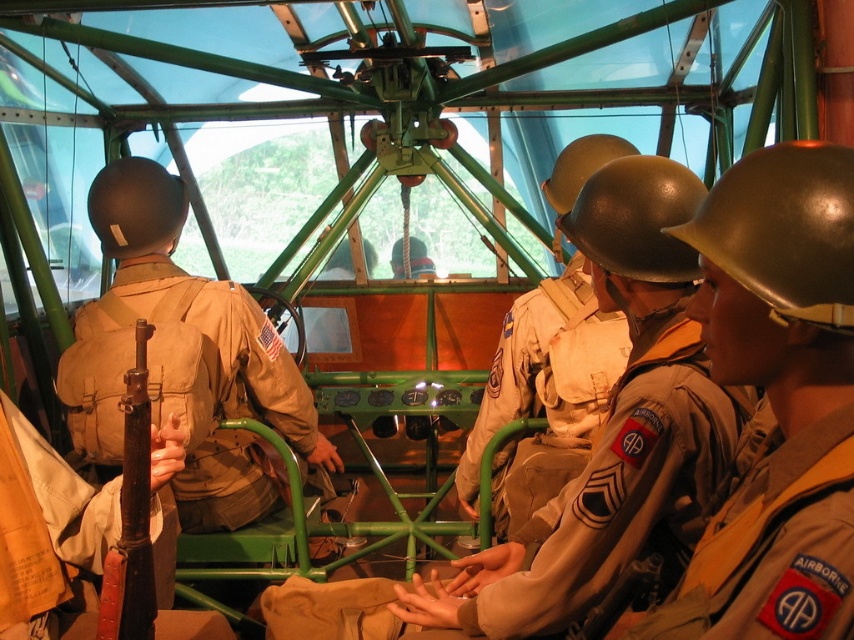
Question: Which point is farther to the camera?

Choices:
 (A) shiny silver helmet at center
 (B) tan canvas uniform at center
 (C) tan fabric uniform at center

Answer: (B)

Question: Which point is closer to the camera?

Choices:
 (A) (732, 628)
 (B) (502, 481)
 (C) (75, 445)
 (D) (718, 484)

Answer: (A)

Question: Does tan fabric uniform at center lie in front of tan fabric patch at center?

Choices:
 (A) yes
 (B) no

Answer: (B)

Question: Can you confirm if shiny silver helmet at center is thinner than tan fabric uniform at center?

Choices:
 (A) yes
 (B) no

Answer: (A)

Question: Which point is closer to the camera?

Choices:
 (A) (139, 289)
 (B) (816, 442)
 (C) (513, 632)

Answer: (B)

Question: Is shiny silver helmet at center closer to camera compared to tan fabric uniform at center?

Choices:
 (A) yes
 (B) no

Answer: (A)